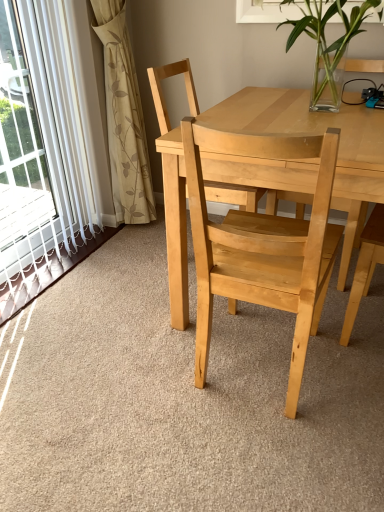
Question: Is clear glass vase at upper center closer to camera compared to natural wood chair at center, the 1th chair viewed from the back?

Choices:
 (A) yes
 (B) no

Answer: (A)

Question: Does clear glass vase at upper center appear on the left side of natural wood chair at center, the 1th chair viewed from the back?

Choices:
 (A) no
 (B) yes

Answer: (A)

Question: Can you confirm if clear glass vase at upper center is positioned to the right of natural wood chair at center, marked as the 2th chair in a front-to-back arrangement?

Choices:
 (A) yes
 (B) no

Answer: (A)

Question: From a real-world perspective, is clear glass vase at upper center physically above natural wood chair at center, marked as the 2th chair in a front-to-back arrangement?

Choices:
 (A) no
 (B) yes

Answer: (B)

Question: Is the position of clear glass vase at upper center more distant than that of natural wood chair at center, the 1th chair viewed from the back?

Choices:
 (A) no
 (B) yes

Answer: (A)

Question: Which is correct: natural wood chair at center, the 2th chair when ordered from back to front, is inside natural wood chair at center, the 1th chair viewed from the back, or outside of it?

Choices:
 (A) outside
 (B) inside

Answer: (A)

Question: From the image's perspective, is natural wood chair at center, placed as the first chair when sorted from front to back, positioned above or below natural wood chair at center, marked as the 2th chair in a front-to-back arrangement?

Choices:
 (A) above
 (B) below

Answer: (B)

Question: Considering the positions of natural wood chair at center, the 2th chair when ordered from back to front, and natural wood chair at center, marked as the 2th chair in a front-to-back arrangement, in the image, is natural wood chair at center, the 2th chair when ordered from back to front, taller or shorter than natural wood chair at center, marked as the 2th chair in a front-to-back arrangement,?

Choices:
 (A) tall
 (B) short

Answer: (B)

Question: Considering the positions of natural wood chair at center, placed as the first chair when sorted from front to back, and natural wood chair at center, marked as the 2th chair in a front-to-back arrangement, in the image, is natural wood chair at center, placed as the first chair when sorted from front to back, bigger or smaller than natural wood chair at center, marked as the 2th chair in a front-to-back arrangement,?

Choices:
 (A) small
 (B) big

Answer: (B)

Question: Is clear glass vase at upper center taller or shorter than natural wood chair at center, the 2th chair when ordered from back to front?

Choices:
 (A) short
 (B) tall

Answer: (A)

Question: Considering the positions of clear glass vase at upper center and natural wood chair at center, placed as the first chair when sorted from front to back, in the image, is clear glass vase at upper center wider or thinner than natural wood chair at center, placed as the first chair when sorted from front to back,?

Choices:
 (A) wide
 (B) thin

Answer: (A)

Question: From a real-world perspective, relative to natural wood chair at center, the 2th chair when ordered from back to front, is clear glass vase at upper center vertically above or below?

Choices:
 (A) above
 (B) below

Answer: (A)

Question: From the image's perspective, is clear glass vase at upper center above or below natural wood chair at center, placed as the first chair when sorted from front to back?

Choices:
 (A) below
 (B) above

Answer: (B)

Question: Is beige floral fabric curtain at left taller or shorter than natural wood chair at center, marked as the 2th chair in a front-to-back arrangement?

Choices:
 (A) short
 (B) tall

Answer: (B)

Question: In the image, is beige floral fabric curtain at left positioned in front of or behind natural wood chair at center, the 1th chair viewed from the back?

Choices:
 (A) behind
 (B) front

Answer: (A)